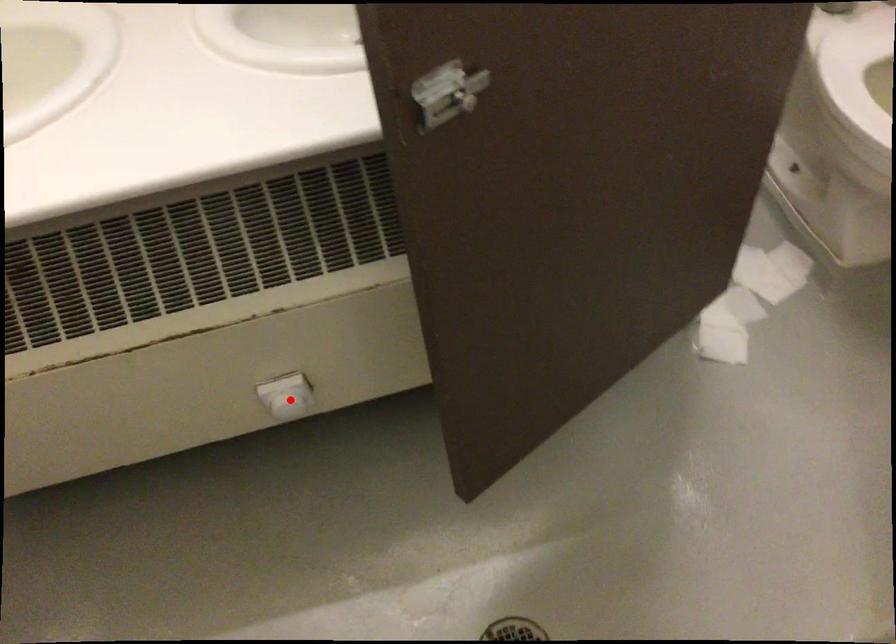
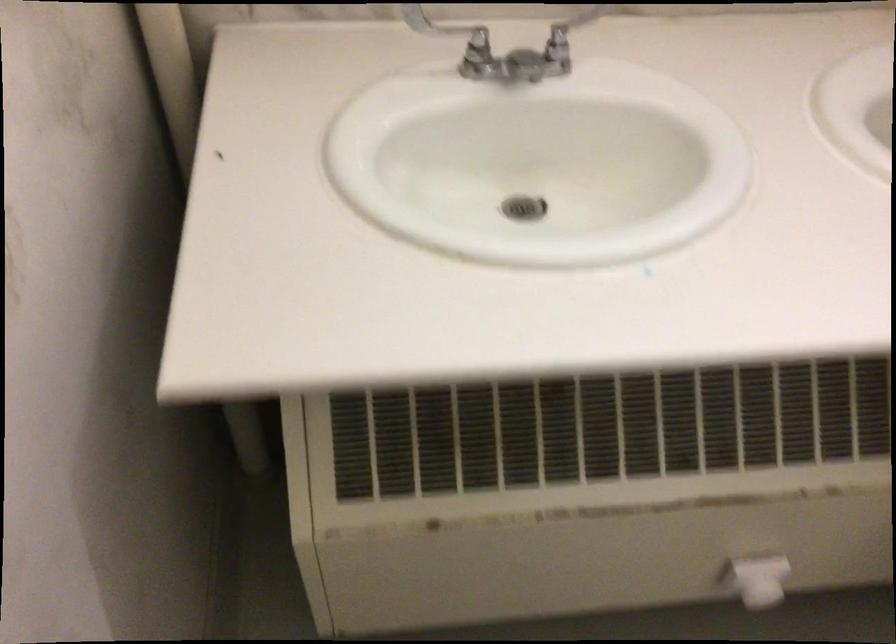
Question: A red point is marked in image1. In image2, is the corresponding 3D point closer to the camera or farther? Reply with the corresponding letter.

Choices:
 (A) The corresponding 3D point is closer.
 (B) The corresponding 3D point is farther.

Answer: (A)